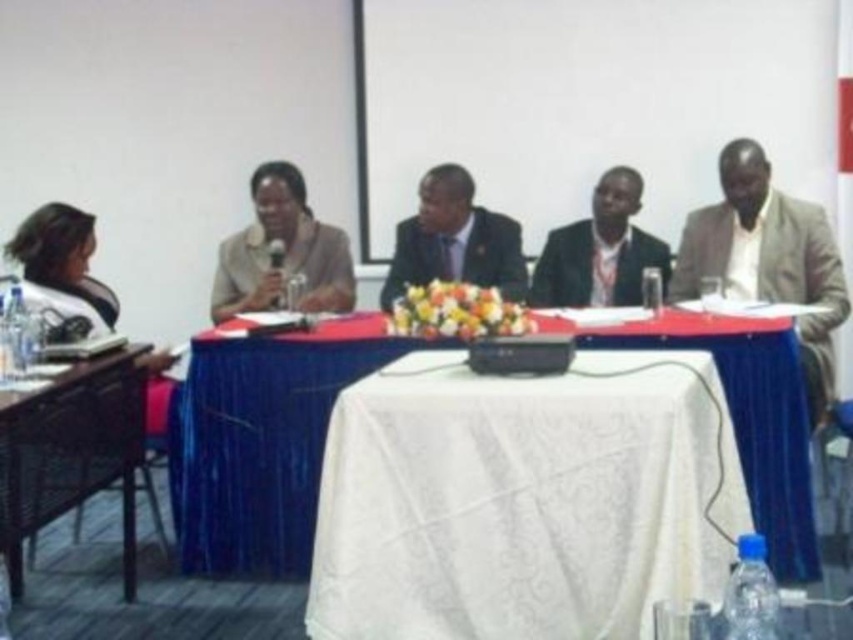
Who is taller, white fabric table at lower left or matte beige jacket at center?

Standing taller between the two is white fabric table at lower left.

Between white fabric table at lower left and matte beige jacket at center, which one appears on the left side from the viewer's perspective?

From the viewer's perspective, white fabric table at lower left appears more on the left side.

Locate an element on the screen. The height and width of the screenshot is (640, 853). white fabric table at lower left is located at coordinates (70, 452).

This screenshot has width=853, height=640. I want to click on white fabric table at lower left, so click(70, 452).

Can you confirm if white lace tablecloth at center is positioned to the left of shiny black suit at center?

In fact, white lace tablecloth at center is to the right of shiny black suit at center.

Who is more forward, (412, 481) or (477, 220)?

Point (412, 481) is in front.

Locate an element on the screen. The height and width of the screenshot is (640, 853). white lace tablecloth at center is located at coordinates (524, 499).

Does point (305, 273) come in front of point (605, 212)?

Yes, it is in front of point (605, 212).

Does matte beige jacket at center appear under dark suit jacket at center?

No, matte beige jacket at center is not below dark suit jacket at center.

Is point (346, 268) positioned before point (630, 285)?

No, (346, 268) is further to viewer.

This screenshot has width=853, height=640. I want to click on matte beige jacket at center, so click(x=283, y=252).